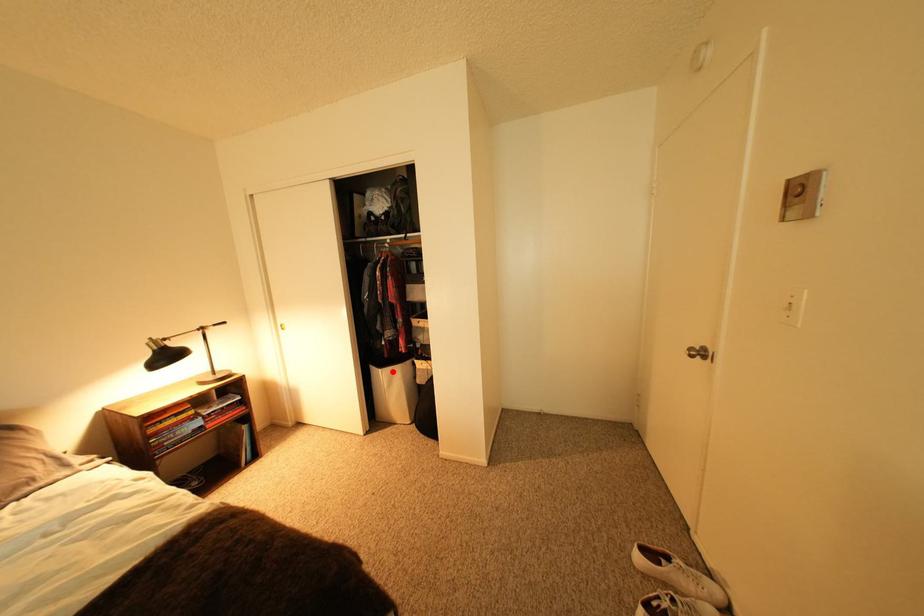
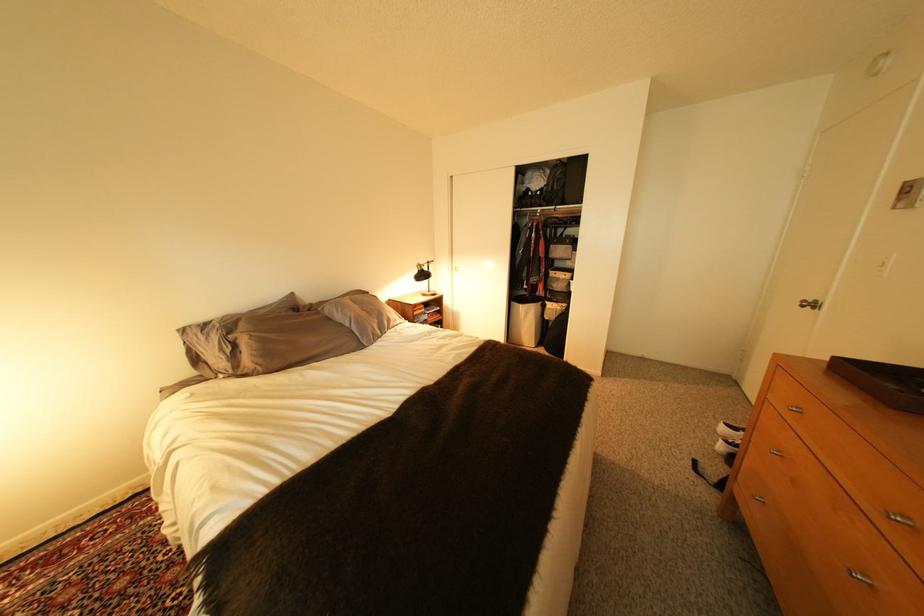
Question: A red point is marked in image1. In image2, is the corresponding 3D point closer to the camera or farther? Reply with the corresponding letter.

Choices:
 (A) The corresponding 3D point is closer.
 (B) The corresponding 3D point is farther.

Answer: (A)